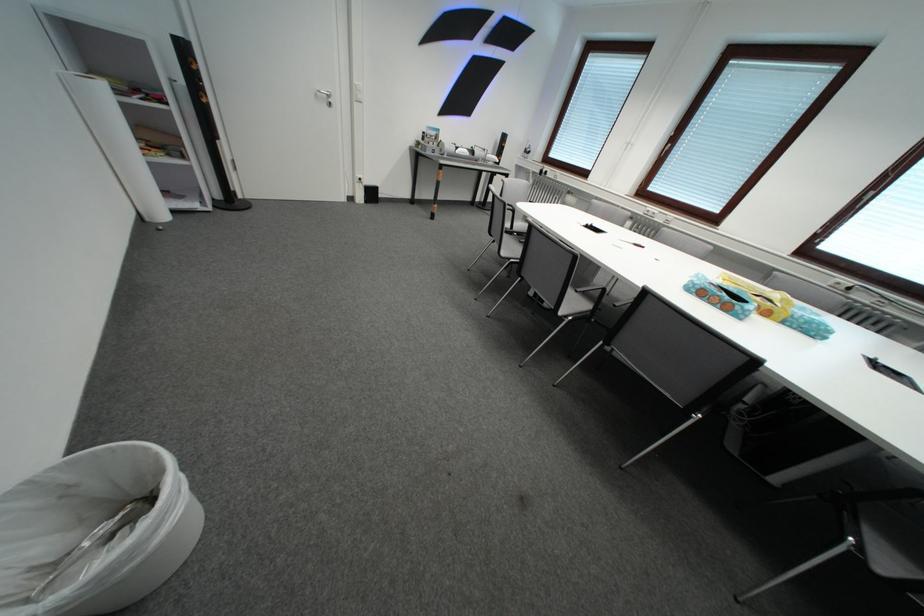
The image size is (924, 616). What are the coordinates of `silver door handle` in the screenshot? It's located at pyautogui.click(x=324, y=97).